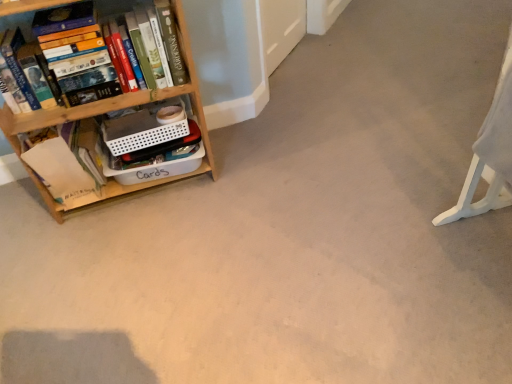
Question: Is wooden bookshelf at left at the back of hardcover book at left?

Choices:
 (A) no
 (B) yes

Answer: (B)

Question: Can you confirm if hardcover book at left is wider than wooden bookshelf at left?

Choices:
 (A) yes
 (B) no

Answer: (B)

Question: From a real-world perspective, is hardcover book at left physically below wooden bookshelf at left?

Choices:
 (A) no
 (B) yes

Answer: (A)

Question: Is hardcover book at left outside wooden bookshelf at left?

Choices:
 (A) no
 (B) yes

Answer: (A)

Question: From the image's perspective, would you say hardcover book at left is shown under wooden bookshelf at left?

Choices:
 (A) yes
 (B) no

Answer: (B)

Question: Considering the positions of wooden bookshelf at left and hardcover book at left in the image, is wooden bookshelf at left wider or thinner than hardcover book at left?

Choices:
 (A) thin
 (B) wide

Answer: (B)

Question: In terms of size, does wooden bookshelf at left appear bigger or smaller than hardcover book at left?

Choices:
 (A) small
 (B) big

Answer: (B)

Question: From a real-world perspective, relative to hardcover book at left, is wooden bookshelf at left vertically above or below?

Choices:
 (A) above
 (B) below

Answer: (B)

Question: Is wooden bookshelf at left taller or shorter than hardcover book at left?

Choices:
 (A) short
 (B) tall

Answer: (B)

Question: From the image's perspective, is white paper at left positioned above or below wooden bookshelf at left?

Choices:
 (A) below
 (B) above

Answer: (A)

Question: Is point (30, 163) closer or farther from the camera than point (53, 117)?

Choices:
 (A) closer
 (B) farther

Answer: (B)

Question: From a real-world perspective, is white paper at left physically located above or below wooden bookshelf at left?

Choices:
 (A) above
 (B) below

Answer: (B)

Question: Is white paper at left wider or thinner than wooden bookshelf at left?

Choices:
 (A) wide
 (B) thin

Answer: (B)

Question: Based on their sizes in the image, would you say white plastic swivel chair at right is bigger or smaller than wooden bookshelf at left?

Choices:
 (A) big
 (B) small

Answer: (B)

Question: From the image's perspective, relative to wooden bookshelf at left, is white plastic swivel chair at right above or below?

Choices:
 (A) above
 (B) below

Answer: (B)